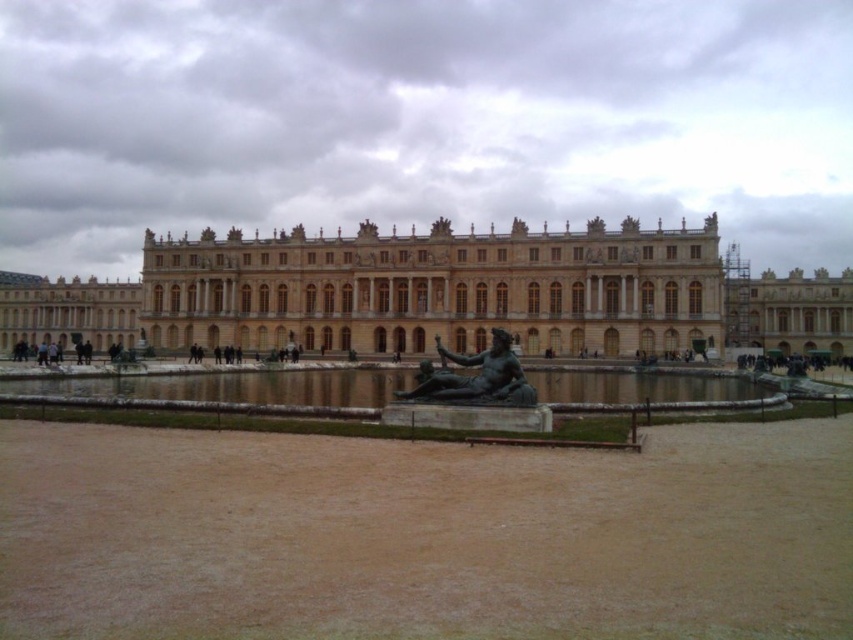
Between point (296, 378) and point (39, 342), which one is positioned in front?

Point (296, 378) is in front.

Does clear water at fountain center have a lesser width compared to dark brown leather person at lower left?

No, clear water at fountain center is not thinner than dark brown leather person at lower left.

The image size is (853, 640). What are the coordinates of `clear water at fountain center` in the screenshot? It's located at (234, 387).

Between point (35, 381) and point (521, 374), which one is positioned in front?

Positioned in front is point (521, 374).

Is clear water at fountain center below bronze statue at center?

Yes.

The height and width of the screenshot is (640, 853). What do you see at coordinates (234, 387) in the screenshot? I see `clear water at fountain center` at bounding box center [234, 387].

Find the location of a particular element. clear water at fountain center is located at coordinates (234, 387).

Describe the element at coordinates (474, 378) in the screenshot. This screenshot has width=853, height=640. I see `bronze statue at center` at that location.

Is the position of bronze statue at center less distant than that of dark brown leather person at lower left?

Yes, bronze statue at center is closer to the viewer.

Is point (509, 349) in front of point (36, 358)?

Yes.

Find the location of `bronze statue at center`. bronze statue at center is located at coordinates (474, 378).